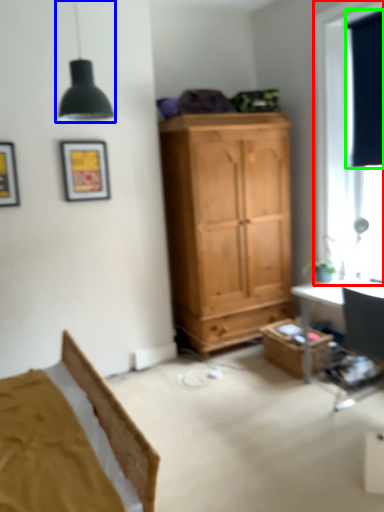
Question: Which object is the farthest from window (highlighted by a red box)? Choose among these: light fixture (highlighted by a blue box) or curtain (highlighted by a green box).

Choices:
 (A) light fixture
 (B) curtain

Answer: (A)